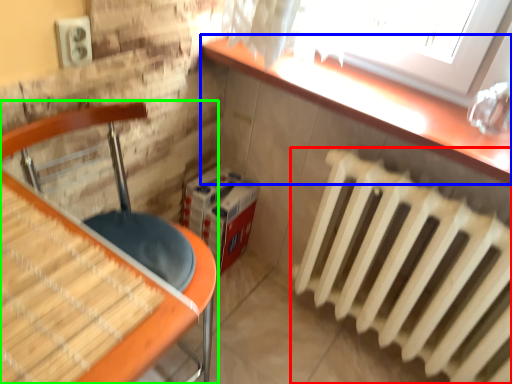
Question: Which is farther away from radiator (highlighted by a red box)? counter top (highlighted by a blue box) or furniture (highlighted by a green box)?

Choices:
 (A) counter top
 (B) furniture

Answer: (B)